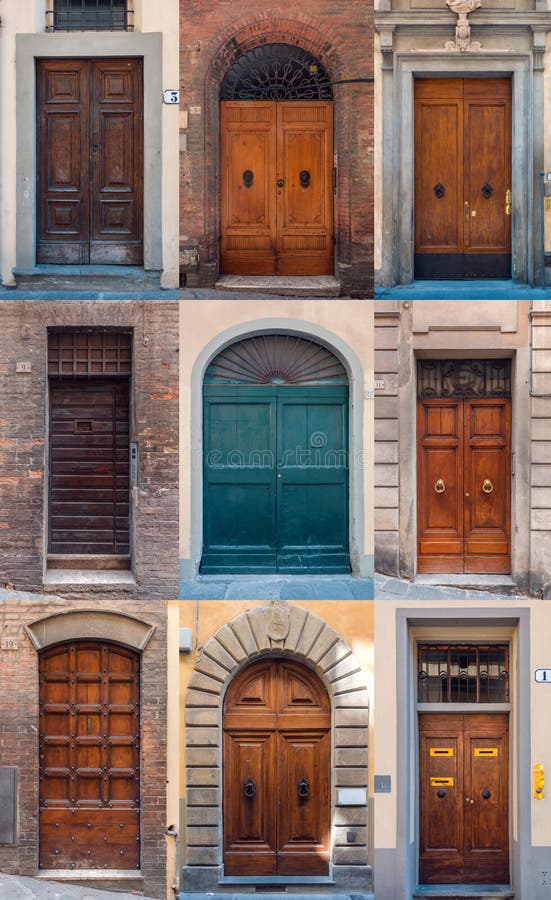
Locate an element on the screen. The image size is (551, 900). hinged door sections is located at coordinates [488, 460], [439, 456], [302, 428], [250, 429], [84, 478], [88, 752], [302, 760], [252, 762], [487, 770], [445, 769].